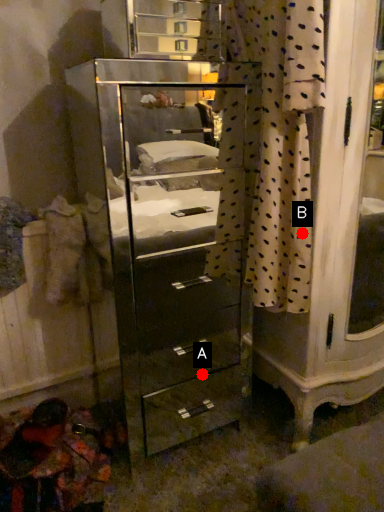
Question: Two points are circled on the image, labeled by A and B beside each circle. Which point is closer to the camera?

Choices:
 (A) A is closer
 (B) B is closer

Answer: (B)